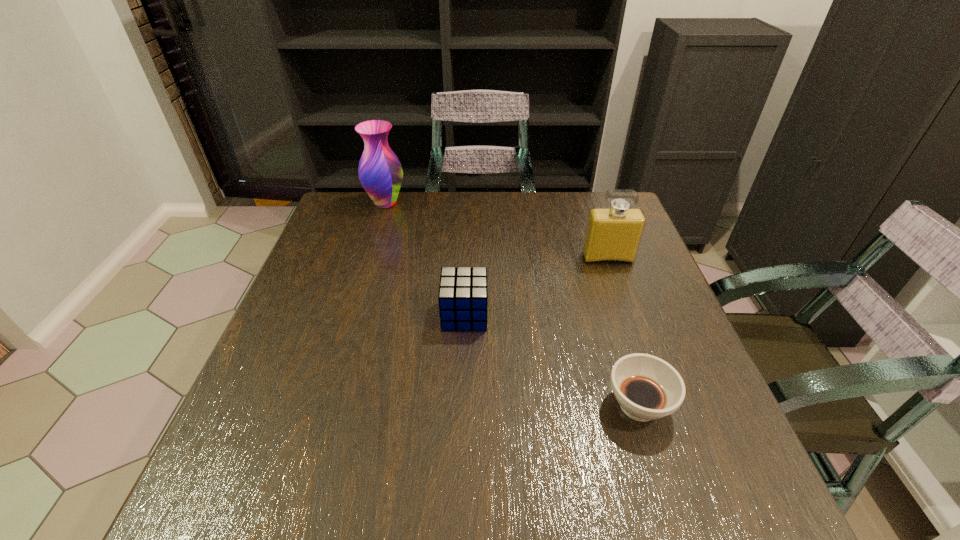
Locate an element on the screen. The width and height of the screenshot is (960, 540). free spot between the third shortest object and the second object from left to right is located at coordinates (536, 287).

Find the location of a particular element. The width and height of the screenshot is (960, 540). empty location between the nearest object and the perfume is located at coordinates (623, 332).

Point out which object is positioned as the nearest to the leftmost object. Please provide its 2D coordinates. Your answer should be formatted as a tuple, i.e. [(x, y)], where the tuple contains the x and y coordinates of a point satisfying the conditions above.

[(463, 295)]

Identify the location of object that is the second closest one to the farthest object. (613, 234).

The width and height of the screenshot is (960, 540). Identify the location of free spot that satisfies the following two spatial constraints: 1. on the front side of the third farthest object; 2. on the left side of the soup bowl. (461, 405).